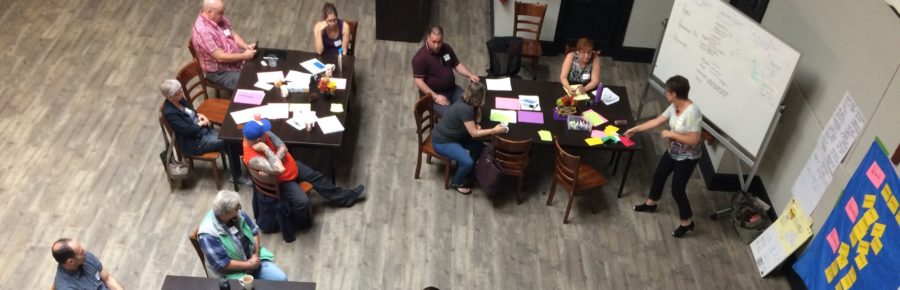
This screenshot has height=290, width=900. I want to click on tables, so click(x=295, y=97), click(x=555, y=104), click(x=176, y=282).